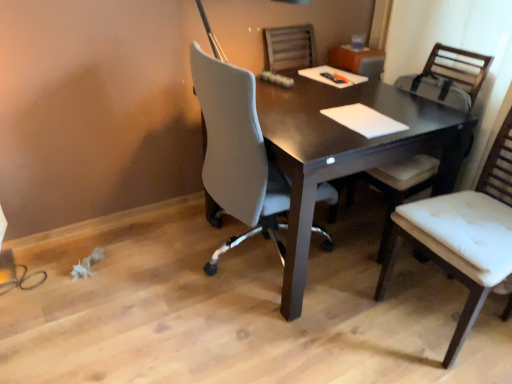
Find the location of a particular element. The height and width of the screenshot is (384, 512). free space to the left of white leather chair at right, which is the 1th chair in front-to-back order is located at coordinates point(361,337).